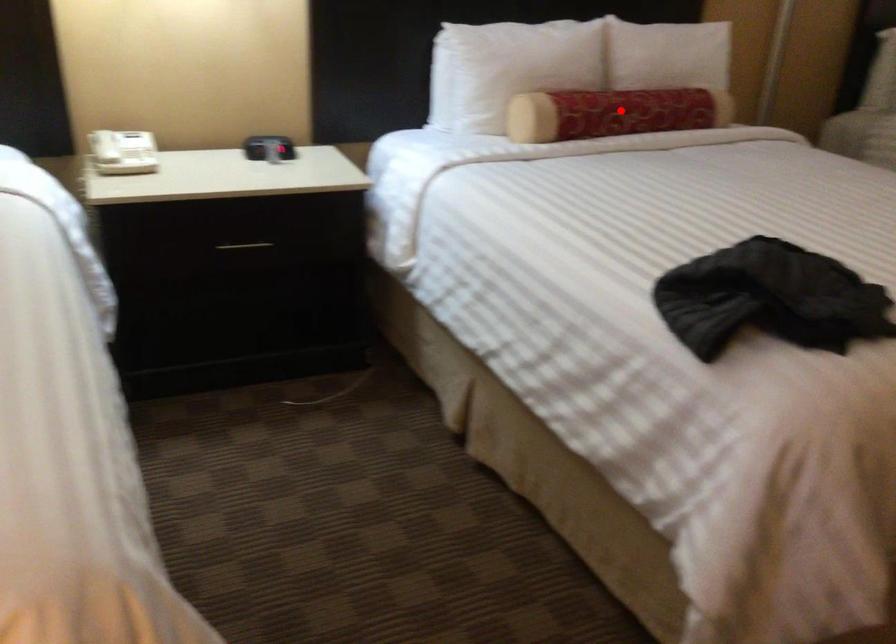
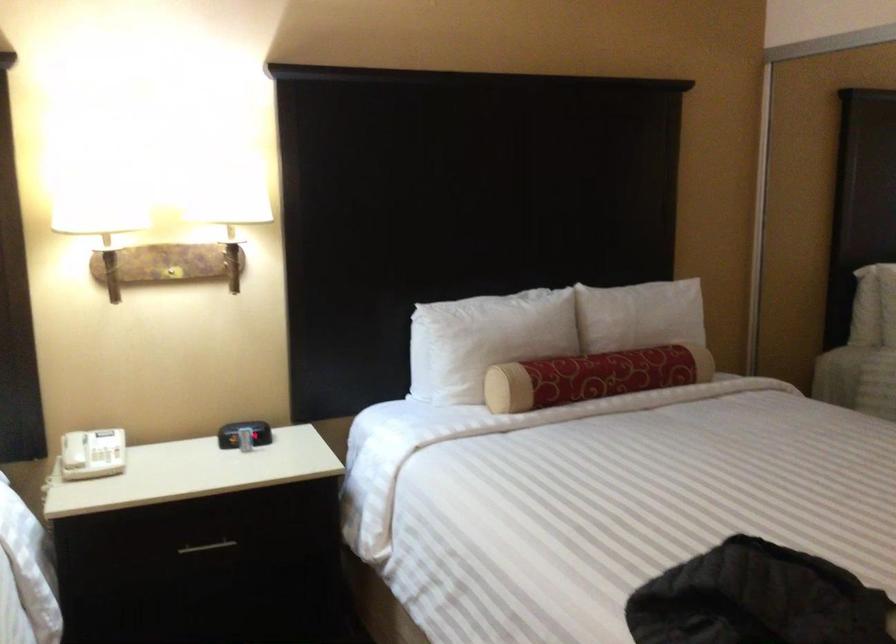
Locate, in the second image, the point that corresponds to the highlighted location in the first image.

(592, 377)